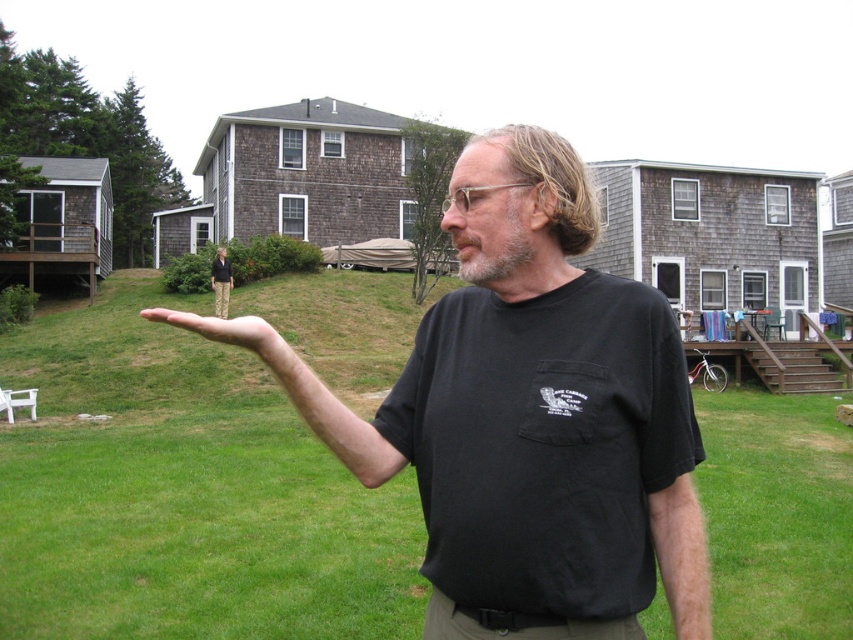
Measure the distance between black cotton t-shirt at center and camera.

black cotton t-shirt at center and camera are 1.53 meters apart from each other.

Locate an element on the screen. Image resolution: width=853 pixels, height=640 pixels. black cotton t-shirt at center is located at coordinates (535, 419).